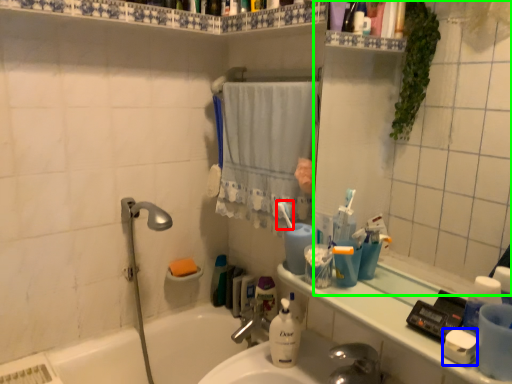
Question: Estimate the real-world distances between objects in this image. Which object is closer to toothbrush (highlighted by a red box), soap (highlighted by a blue box) or mirror (highlighted by a green box)?

Choices:
 (A) soap
 (B) mirror

Answer: (A)